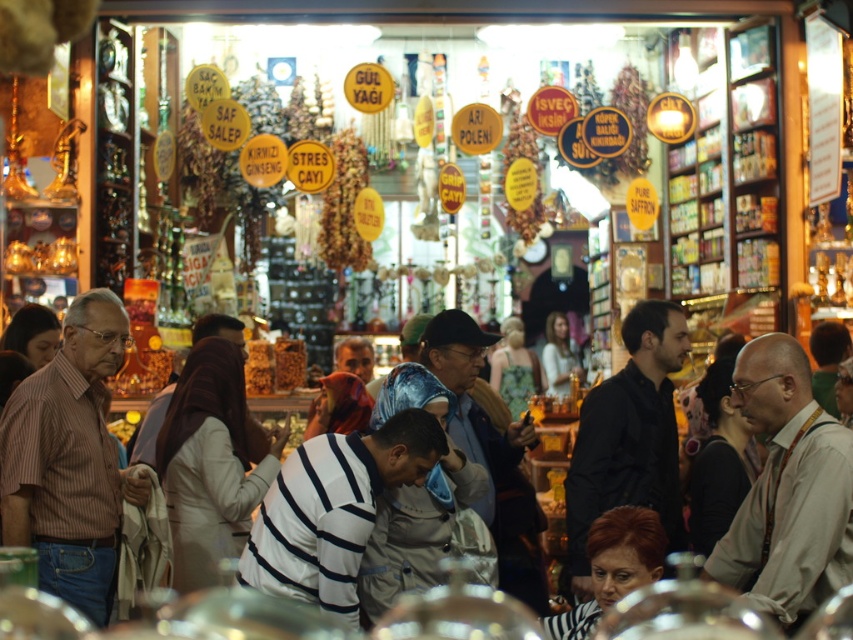
You are a customer in the market and want to buy a shirt. You see both the white striped shirt at center and the black shirt at center. Which one is smaller in size?

The white striped shirt at center is smaller in size compared to the black shirt at center.

You are a customer in the spice market and want to pick up both items located at point (x=757, y=397) and point (x=253, y=540). Which item should you pick up first if you want to minimize the distance you walk?

You should pick up the item at point (x=253, y=540) first because it is closer to you than the item at point (x=757, y=397), which is further away.

You are a customer in this spice market and you want to buy the brown leather shirt at right. Where exactly is it located in the image?

The brown leather shirt at right is located at point coordinates of 0.766 on the x axis and 0.924 on the y axis.